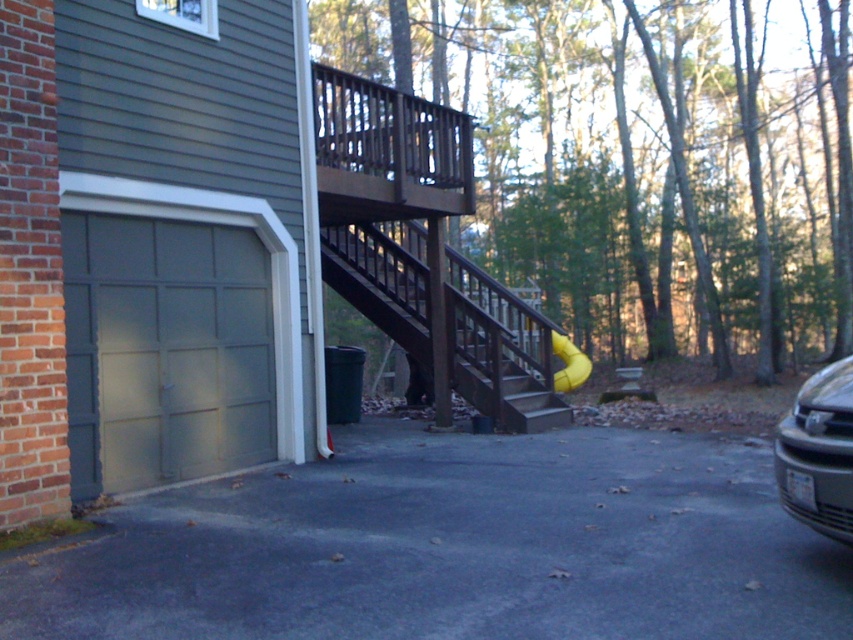
Is point (86, 221) positioned in front of point (511, 376)?

Yes, point (86, 221) is closer to viewer.

Can you confirm if matte gray garage door at lower left is positioned to the right of brown wooden stairs at center?

In fact, matte gray garage door at lower left is to the left of brown wooden stairs at center.

Image resolution: width=853 pixels, height=640 pixels. Find the location of `matte gray garage door at lower left`. matte gray garage door at lower left is located at coordinates (173, 348).

Locate an element on the screen. matte gray garage door at lower left is located at coordinates (173, 348).

Measure the distance between matte gray garage door at lower left and yellow rubber slide at center.

A distance of 30.87 feet exists between matte gray garage door at lower left and yellow rubber slide at center.

Between point (76, 403) and point (553, 330), which one is positioned in front?

Point (76, 403) is in front.

The width and height of the screenshot is (853, 640). I want to click on matte gray garage door at lower left, so click(x=173, y=348).

Is point (746, 476) positioned in front of point (798, 452)?

No, it is behind (798, 452).

Between gray asphalt driveway at lower center and silver metallic car at right, which one is positioned higher?

silver metallic car at right is above.

Who is more distant from viewer, (622, 612) or (827, 509)?

Positioned behind is point (827, 509).

The height and width of the screenshot is (640, 853). Find the location of `gray asphalt driveway at lower center`. gray asphalt driveway at lower center is located at coordinates (453, 547).